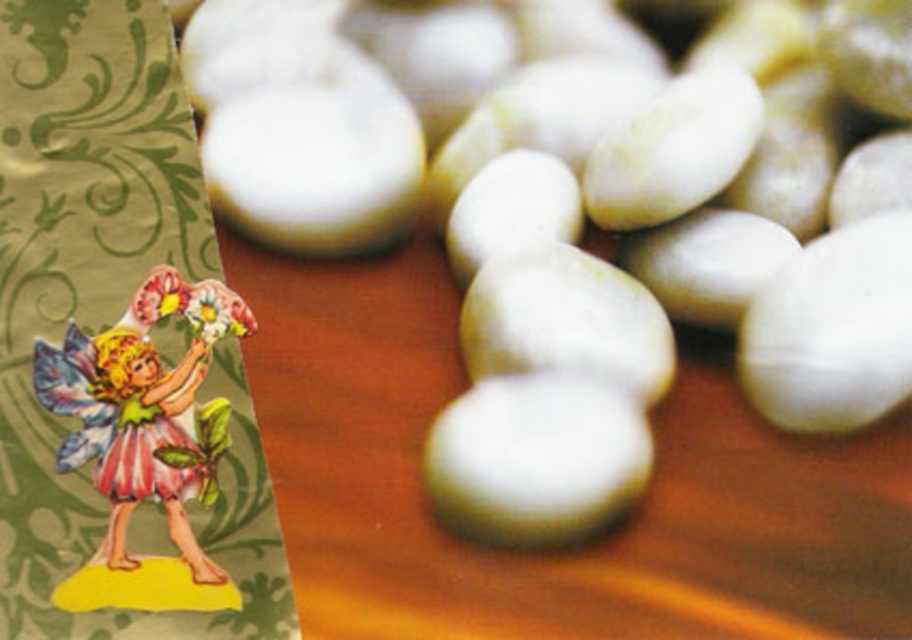
You are arranging a small garden decoration scene. You have a white smooth stone at left and a pastel paper fairy at left. Which object should you move closer to the camera to make the fairy more prominent?

You should move the white smooth stone at left closer to the camera because it is currently closer than the pastel paper fairy at left, so moving it forward would allow the fairy to appear more prominent in the composition.

You are arranging a small display on a wooden table. You have two items to place on the table. The white smooth stone at left and the paper fairy at left. According to the image, which item should you place first if you want to position them in the same relative positions as shown?

You should place the paper fairy at left first because the white smooth stone at left is to the right of the paper fairy at left, so placing the fairy first allows you to position the stone to its right.

You are a baker arranging decorations for a dessert table. You have a white smooth stone at left and a pastel paper fairy at left. Which object should you place closer to the edge of the table to ensure both fit without overlapping?

The white smooth stone at left is bigger than the pastel paper fairy at left, so you should place the white smooth stone at left closer to the edge to give it more space, allowing both to fit without overlapping.